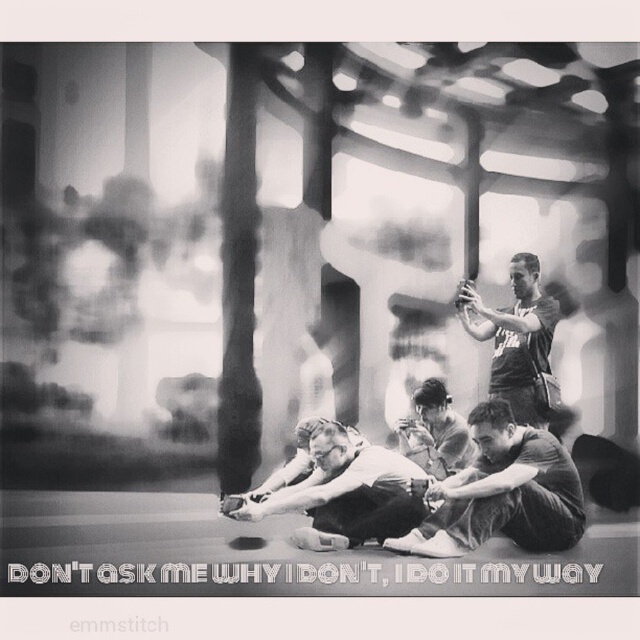
Between dark gray fabric shirt at lower right and smooth fabric shirt at center, which one appears on the right side from the viewer's perspective?

From the viewer's perspective, dark gray fabric shirt at lower right appears more on the right side.

Is dark gray fabric shirt at lower right to the left of smooth fabric shirt at center from the viewer's perspective?

Incorrect, dark gray fabric shirt at lower right is not on the left side of smooth fabric shirt at center.

Between point (572, 541) and point (426, 401), which one is positioned behind?

The point (426, 401) is more distant.

You are a GUI agent. You are given a task and a screenshot of the screen. Output one action in this format:
    pyautogui.click(x=<x>, y=<y>)
    Task: Click on the dark gray fabric shirt at lower right
    The height and width of the screenshot is (640, 640).
    Given the screenshot: What is the action you would take?
    pyautogui.click(x=502, y=492)

Who is higher up, white fabric shirt at center or smooth fabric shirt at center?

smooth fabric shirt at center

From the picture: Does white fabric shirt at center have a lesser height compared to smooth fabric shirt at center?

No, white fabric shirt at center is not shorter than smooth fabric shirt at center.

Is point (355, 444) less distant than point (451, 417)?

Yes.

Where is `white fabric shirt at center`? The image size is (640, 640). white fabric shirt at center is located at coordinates (342, 490).

Is dark gray fabric shirt at lower right to the right of white fabric shirt at center from the viewer's perspective?

Indeed, dark gray fabric shirt at lower right is positioned on the right side of white fabric shirt at center.

Can you confirm if dark gray fabric shirt at lower right is shorter than white fabric shirt at center?

No.

Measure the distance between dark gray fabric shirt at lower right and camera.

They are 7.37 meters apart.

Where is `dark gray fabric shirt at lower right`? The height and width of the screenshot is (640, 640). dark gray fabric shirt at lower right is located at coordinates (502, 492).